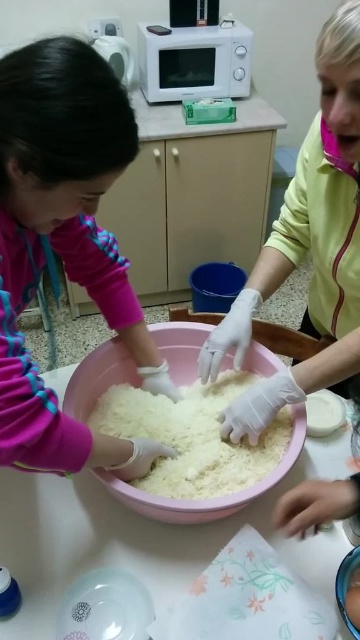
You are standing in a kitchen and see the pink fabric at center and the white matte microwave at upper center. Which object is nearer to you?

The pink fabric at center is closer to the viewer than the white matte microwave at upper center.

You are trying to place a small decorative item on the white glossy table at center. Considering the white fluffy rice at center is already there, will there be enough space left on the table?

The white glossy table at center might be wider than white fluffy rice at center, so there could be enough space left on the table after placing the rice.